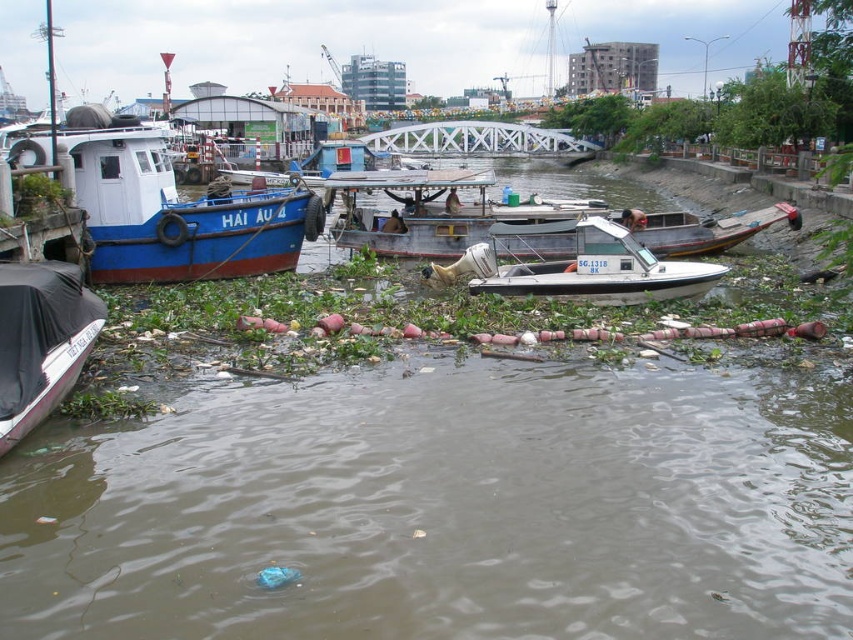
Question: Can you confirm if blue matte boat at left is bigger than white matte boat at center?

Choices:
 (A) no
 (B) yes

Answer: (B)

Question: Is the position of blue matte boat at left less distant than that of white matte boat at center?

Choices:
 (A) no
 (B) yes

Answer: (B)

Question: Which point is closer to the camera?

Choices:
 (A) (258, 192)
 (B) (583, 296)

Answer: (B)

Question: Where is blue matte boat at left located in relation to black tarpaulin boat at lower left in the image?

Choices:
 (A) right
 (B) left

Answer: (B)

Question: Which point appears farthest from the camera in this image?

Choices:
 (A) (752, 220)
 (B) (161, 170)

Answer: (A)

Question: Which object is positioned farthest from the blue matte boat at left?

Choices:
 (A) black tarpaulin boat at lower left
 (B) white plastic boat at center

Answer: (A)